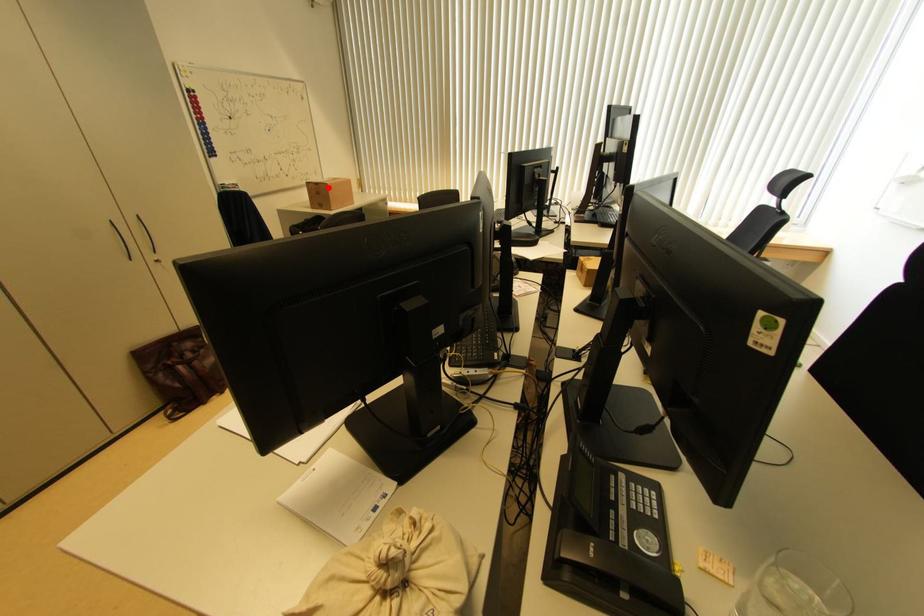
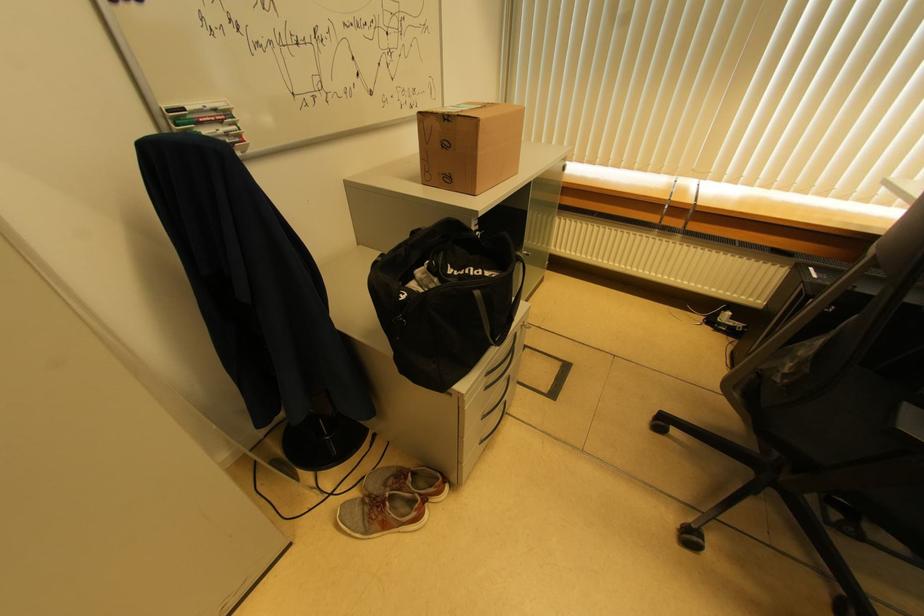
Where in the second image is the point corresponding to the highlighted location from the first image?

(477, 124)